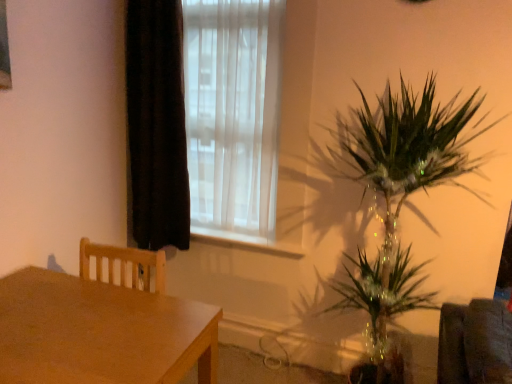
Question: From the image's perspective, is black velvet curtain at left on top of white sheer curtain at upper center?

Choices:
 (A) no
 (B) yes

Answer: (A)

Question: From the image's perspective, is black velvet curtain at left under white sheer curtain at upper center?

Choices:
 (A) no
 (B) yes

Answer: (B)

Question: Would you consider black velvet curtain at left to be distant from white sheer curtain at upper center?

Choices:
 (A) no
 (B) yes

Answer: (A)

Question: From a real-world perspective, does black velvet curtain at left stand above white sheer curtain at upper center?

Choices:
 (A) no
 (B) yes

Answer: (A)

Question: Is black velvet curtain at left at the right side of white sheer curtain at upper center?

Choices:
 (A) no
 (B) yes

Answer: (A)

Question: Is black velvet curtain at left further to the viewer compared to white sheer curtain at upper center?

Choices:
 (A) no
 (B) yes

Answer: (B)

Question: Can you see white sheer curtain at upper center touching white plastic window sill at center?

Choices:
 (A) yes
 (B) no

Answer: (B)

Question: Is white sheer curtain at upper center taller than white plastic window sill at center?

Choices:
 (A) no
 (B) yes

Answer: (B)

Question: Is white sheer curtain at upper center far from white plastic window sill at center?

Choices:
 (A) yes
 (B) no

Answer: (B)

Question: Does white sheer curtain at upper center come in front of white plastic window sill at center?

Choices:
 (A) no
 (B) yes

Answer: (B)

Question: Is white sheer curtain at upper center located outside white plastic window sill at center?

Choices:
 (A) yes
 (B) no

Answer: (A)

Question: From a real-world perspective, is white sheer curtain at upper center beneath white plastic window sill at center?

Choices:
 (A) no
 (B) yes

Answer: (A)

Question: Does white sheer curtain at upper center have a greater width compared to black velvet curtain at left?

Choices:
 (A) no
 (B) yes

Answer: (A)